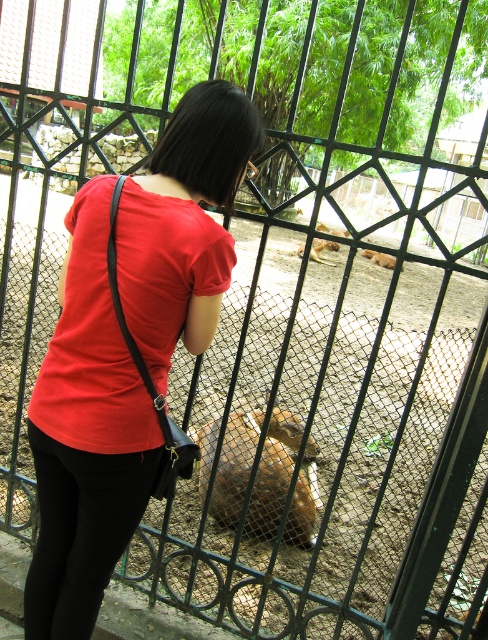
Question: Among these objects, which one is farthest from the camera?

Choices:
 (A) brown furry deer at center
 (B) matte red shirt at center

Answer: (A)

Question: Is brown furry animal at center thinner than brown furry deer at center?

Choices:
 (A) yes
 (B) no

Answer: (A)

Question: Is matte red shirt at center to the left of brown furry dog at center from the viewer's perspective?

Choices:
 (A) yes
 (B) no

Answer: (A)

Question: Which point is closer to the camera taking this photo?

Choices:
 (A) (292, 515)
 (B) (375, 260)

Answer: (A)

Question: Estimate the real-world distances between objects in this image. Which object is farther from the matte red shirt at center?

Choices:
 (A) brown furry dog at center
 (B) brown furry deer at center

Answer: (A)

Question: Is brown furry deer at center wider than brown furry dog at center?

Choices:
 (A) yes
 (B) no

Answer: (A)